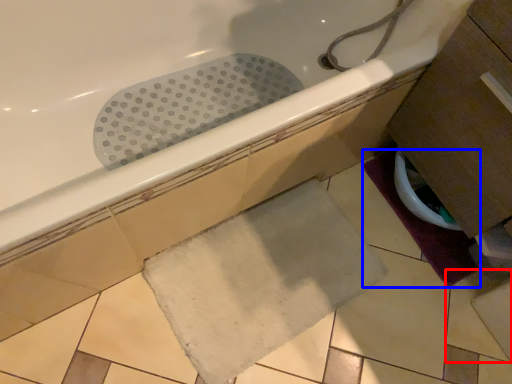
Question: Among these objects, which one is nearest to the camera, ceramic tile (highlighted by a red box) or bath mat (highlighted by a blue box)?

Choices:
 (A) ceramic tile
 (B) bath mat

Answer: (A)